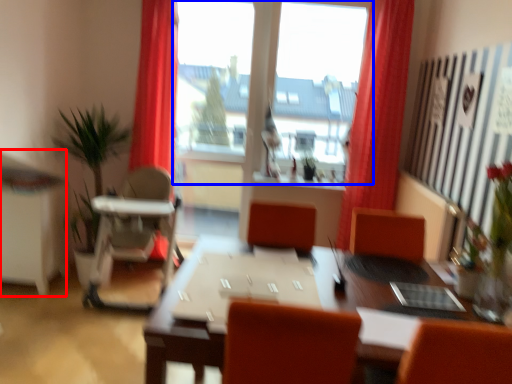
Question: Among these objects, which one is farthest to the camera, computer desk (highlighted by a red box) or window (highlighted by a blue box)?

Choices:
 (A) computer desk
 (B) window

Answer: (B)